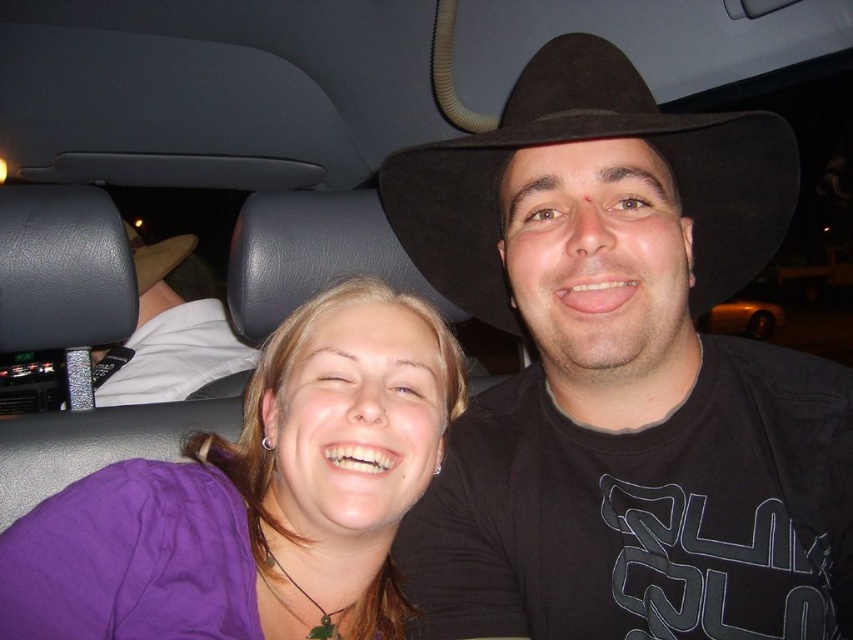
Question: Among these objects, which one is farthest from the camera?

Choices:
 (A) black felt fedora at center
 (B) brown felt hat at upper center
 (C) purple fabric shirt at center
 (D) black felt hat at upper right

Answer: (B)

Question: Is black felt hat at upper right smaller than black felt fedora at center?

Choices:
 (A) yes
 (B) no

Answer: (B)

Question: Among these points, which one is farthest from the camera?

Choices:
 (A) (126, 232)
 (B) (659, 550)
 (C) (148, 317)

Answer: (C)

Question: Is purple fabric shirt at center below brown felt hat at upper center?

Choices:
 (A) no
 (B) yes

Answer: (B)

Question: Which point is closer to the camera taking this photo?

Choices:
 (A) (703, 280)
 (B) (483, 465)

Answer: (B)

Question: Can you confirm if black felt hat at upper right is positioned to the left of black felt fedora at center?

Choices:
 (A) no
 (B) yes

Answer: (A)